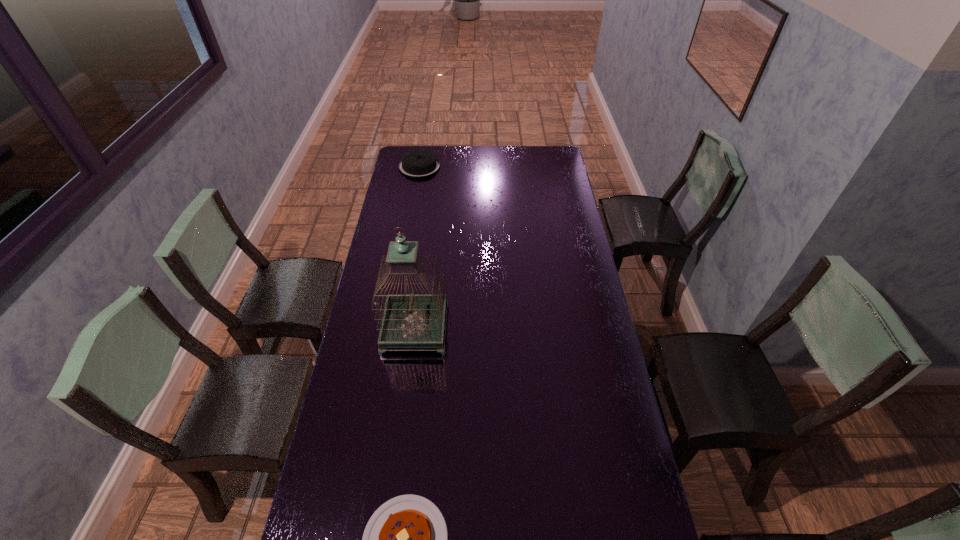
This screenshot has width=960, height=540. I want to click on birdcage, so click(x=412, y=320).

Where is `the tallest object`? The image size is (960, 540). the tallest object is located at coordinates (412, 320).

Find the location of `the second shortest object`. the second shortest object is located at coordinates (418, 163).

Where is `the farthest object`? The height and width of the screenshot is (540, 960). the farthest object is located at coordinates (418, 163).

The height and width of the screenshot is (540, 960). I want to click on vacant region located 0.350m at the door of the birdcage, so click(546, 329).

The image size is (960, 540). I want to click on vacant area situated on the front of the farthest object, so click(415, 193).

Image resolution: width=960 pixels, height=540 pixels. I want to click on object situated at the far edge, so click(x=418, y=163).

Where is `birdcage located at the left edge`? The image size is (960, 540). birdcage located at the left edge is located at coordinates (412, 320).

The height and width of the screenshot is (540, 960). In order to click on pancake that is at the left edge in this screenshot , I will do `click(418, 163)`.

I want to click on object present at the far left corner, so click(418, 163).